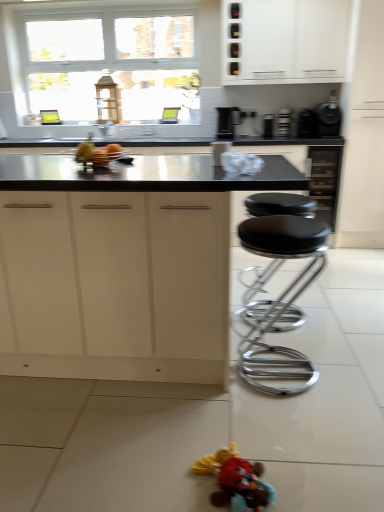
Question: From a real-world perspective, is black matte coffee maker at upper right, which is counted as the first appliance, starting from the right, physically above black chrome stool at center?

Choices:
 (A) no
 (B) yes

Answer: (B)

Question: Is black chrome stool at center located within black matte coffee maker at upper right, the fifth appliance viewed from the left?

Choices:
 (A) yes
 (B) no

Answer: (B)

Question: Is black matte coffee maker at upper right, the fifth appliance viewed from the left, aimed at black chrome stool at center?

Choices:
 (A) yes
 (B) no

Answer: (A)

Question: Can you confirm if black matte coffee maker at upper right, the fifth appliance viewed from the left, is shorter than black chrome stool at center?

Choices:
 (A) yes
 (B) no

Answer: (A)

Question: Is black matte coffee maker at upper right, the fifth appliance viewed from the left, at the right side of black chrome stool at center?

Choices:
 (A) no
 (B) yes

Answer: (B)

Question: Does black matte coffee maker at upper right, the fifth appliance viewed from the left, touch black chrome stool at center?

Choices:
 (A) no
 (B) yes

Answer: (A)

Question: Does black plastic toaster at upper center, placed as the 2th appliance when sorted from left to right, have a larger size compared to black plastic toaster at upper right, which appears as the 2th appliance when viewed from the right?

Choices:
 (A) no
 (B) yes

Answer: (A)

Question: Considering the relative positions of black plastic toaster at upper center, the fourth appliance from the right, and black plastic toaster at upper right, which appears as the 2th appliance when viewed from the right, in the image provided, is black plastic toaster at upper center, the fourth appliance from the right, to the left of black plastic toaster at upper right, which appears as the 2th appliance when viewed from the right, from the viewer's perspective?

Choices:
 (A) yes
 (B) no

Answer: (A)

Question: Considering the relative sizes of black plastic toaster at upper center, the fourth appliance from the right, and black plastic toaster at upper right, which appears as the 2th appliance when viewed from the right, in the image provided, is black plastic toaster at upper center, the fourth appliance from the right, smaller than black plastic toaster at upper right, which appears as the 2th appliance when viewed from the right,?

Choices:
 (A) yes
 (B) no

Answer: (A)

Question: Does black plastic toaster at upper center, placed as the 2th appliance when sorted from left to right, appear on the right side of black plastic toaster at upper right, which appears as the 2th appliance when viewed from the right?

Choices:
 (A) yes
 (B) no

Answer: (B)

Question: Does black plastic toaster at upper center, placed as the 2th appliance when sorted from left to right, have a greater height compared to black plastic toaster at upper right, acting as the 4th appliance starting from the left?

Choices:
 (A) yes
 (B) no

Answer: (B)

Question: Can you confirm if black plastic toaster at upper center, placed as the 2th appliance when sorted from left to right, is thinner than black plastic toaster at upper right, acting as the 4th appliance starting from the left?

Choices:
 (A) no
 (B) yes

Answer: (B)

Question: From a real-world perspective, is black plastic toaster at upper right, acting as the 4th appliance starting from the left, physically above black chrome stool at center?

Choices:
 (A) yes
 (B) no

Answer: (A)